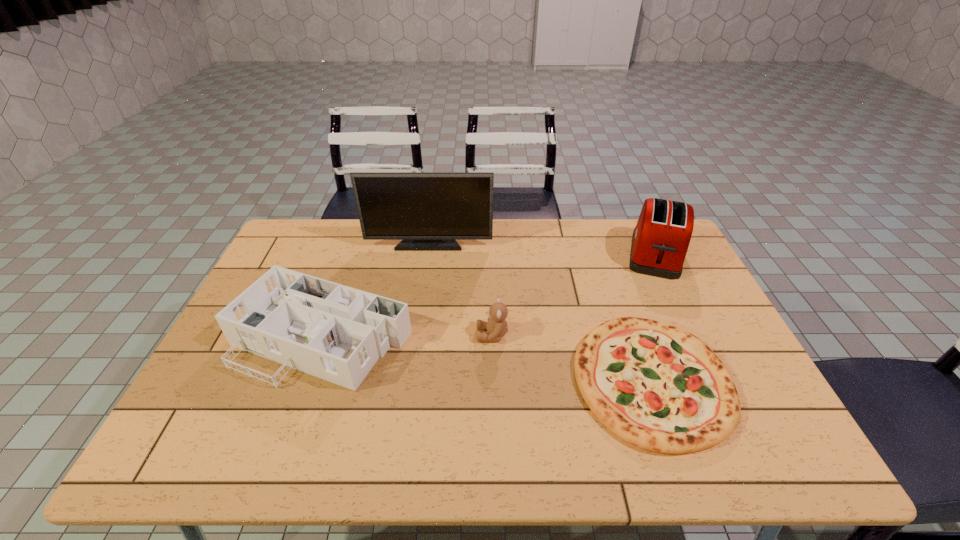
Find the location of a particular element. This screenshot has height=540, width=960. blank area in the image that satisfies the following two spatial constraints: 1. on the back side of the second tallest object; 2. on the right side of the pizza is located at coordinates (608, 255).

What are the coordinates of `blank space that satisfies the following two spatial constraints: 1. on the screen side of the pizza; 2. on the right side of the monitor` in the screenshot? It's located at (409, 380).

Image resolution: width=960 pixels, height=540 pixels. I want to click on free space that satisfies the following two spatial constraints: 1. on the front side of the dollhouse; 2. on the right side of the shortest object, so click(307, 380).

The image size is (960, 540). I want to click on free space that satisfies the following two spatial constraints: 1. on the face of the teddy bear; 2. on the back side of the pizza, so click(493, 380).